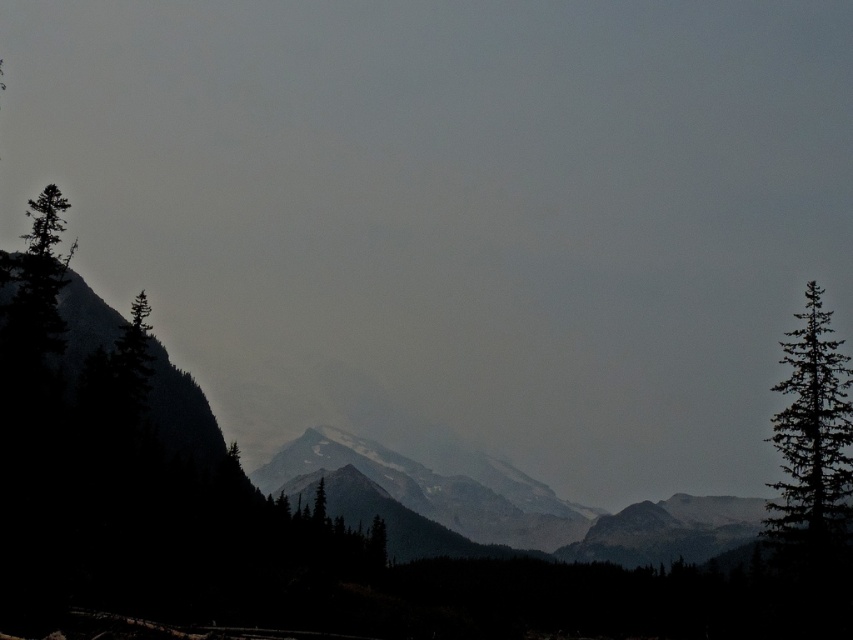
Question: Based on their relative distances, which object is nearer to the green matte tree at center?

Choices:
 (A) green matte tree at left
 (B) green matte tree at right
 (C) snowy granite mountain range at center

Answer: (C)

Question: Which of the following is the farthest from the observer?

Choices:
 (A) snowy granite mountain range at center
 (B) green matte tree at right

Answer: (A)

Question: Does snowy granite mountain range at center have a greater width compared to green matte tree at left?

Choices:
 (A) yes
 (B) no

Answer: (A)

Question: Considering the real-world distances, which object is farthest from the green matte tree at left?

Choices:
 (A) snowy granite mountain range at center
 (B) green matte tree at right
 (C) green matte tree at center

Answer: (A)

Question: Does green matte tree at right appear under green matte tree at left?

Choices:
 (A) no
 (B) yes

Answer: (B)

Question: Can you confirm if snowy granite mountain range at center is smaller than green matte tree at left?

Choices:
 (A) no
 (B) yes

Answer: (A)